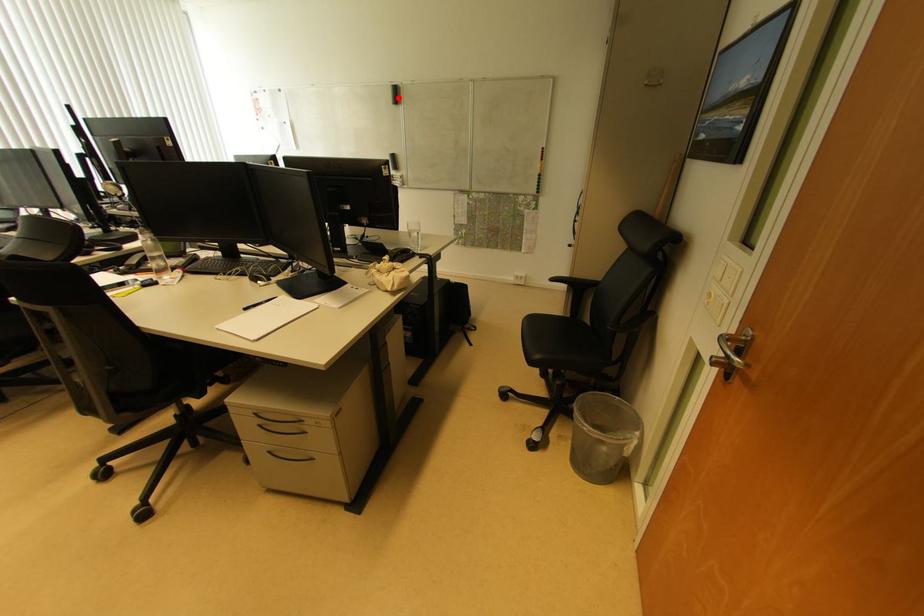
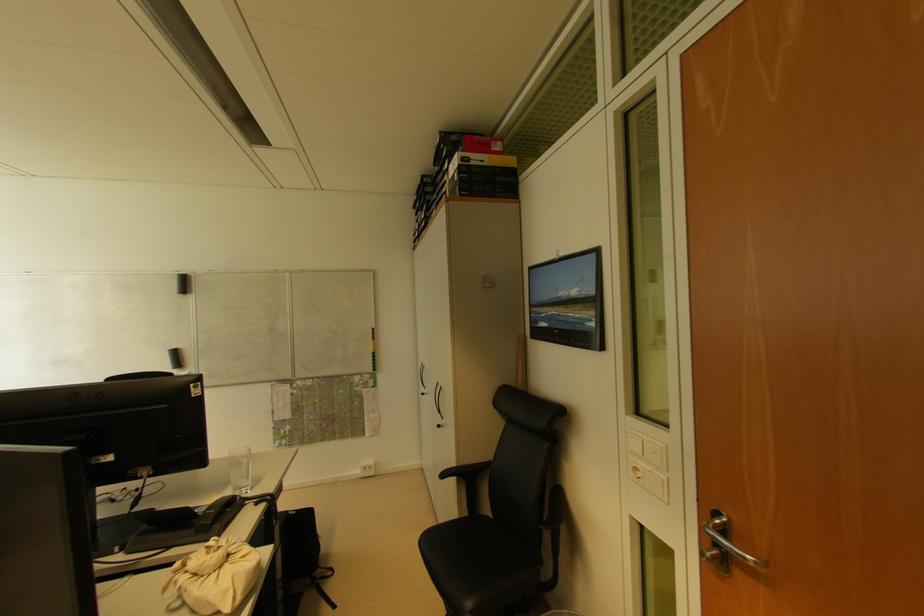
Find the pixel in the second image that matches the highlighted location in the first image.

(187, 286)